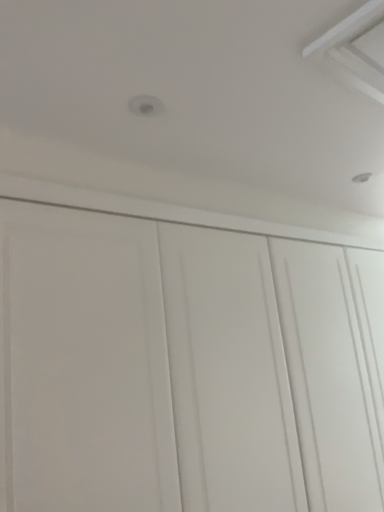
Question: Should I look upward or downward to see white matte cupboard at center?

Choices:
 (A) down
 (B) up

Answer: (A)